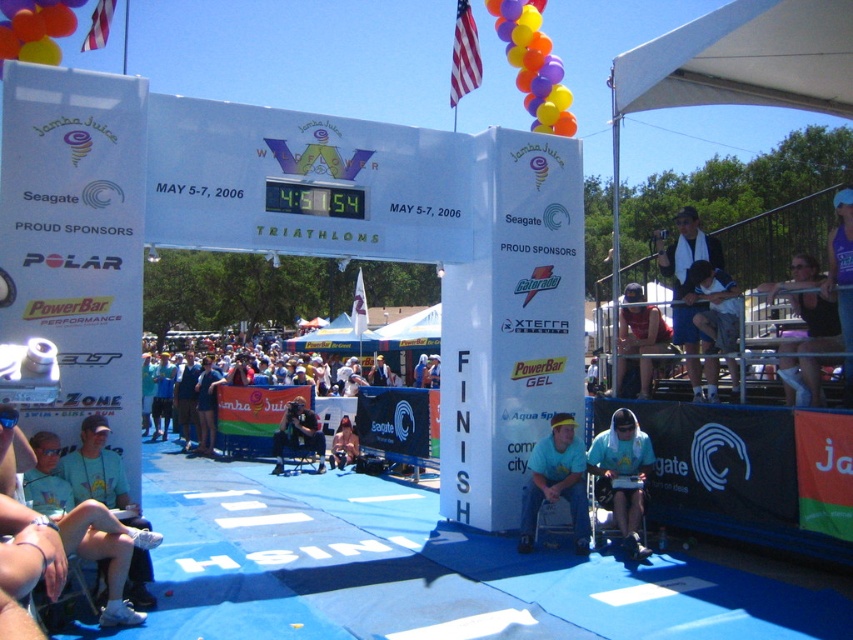
Which of these two, orange glossy balloons at upper center or matte red tank top at center, stands taller?

Standing taller between the two is orange glossy balloons at upper center.

You are a GUI agent. You are given a task and a screenshot of the screen. Output one action in this format:
    pyautogui.click(x=<x>, y=<y>)
    Task: Click on the orange glossy balloons at upper center
    This screenshot has height=640, width=853.
    Given the screenshot: What is the action you would take?
    pyautogui.click(x=532, y=65)

Between point (801, 8) and point (331, 465), which one is positioned in front?

Positioned in front is point (801, 8).

This screenshot has width=853, height=640. In order to click on white fabric canopy at upper right in this screenshot , I will do `click(746, 60)`.

Can you confirm if orange glossy balloons at upper center is bigger than light blue t-shirt at center?

Correct, orange glossy balloons at upper center is larger in size than light blue t-shirt at center.

Is point (505, 10) positioned in front of point (585, 516)?

No, it is not.

Locate an element on the screen. The height and width of the screenshot is (640, 853). orange glossy balloons at upper center is located at coordinates (532, 65).